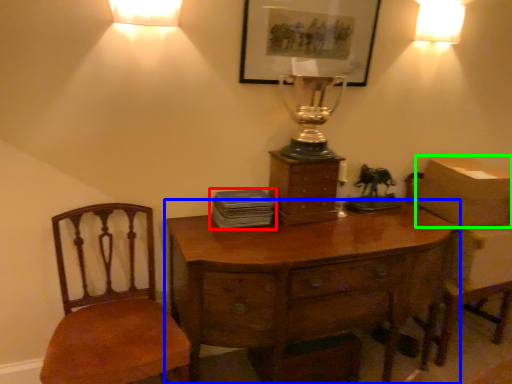
Question: Which object is the farthest from book (highlighted by a red box)? Choose among these: desk (highlighted by a blue box) or cardboard box (highlighted by a green box).

Choices:
 (A) desk
 (B) cardboard box

Answer: (B)